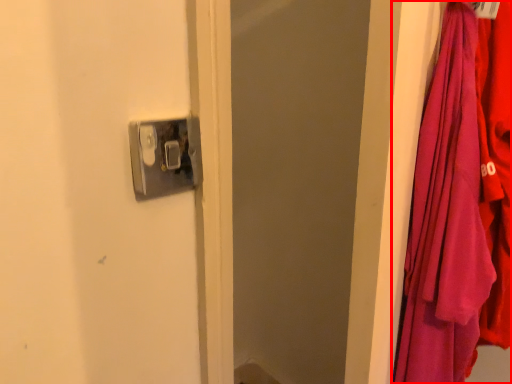
Question: From the image's perspective, what is the correct spatial positioning of curtain (annotated by the red box) in reference to door handle?

Choices:
 (A) above
 (B) below

Answer: (B)